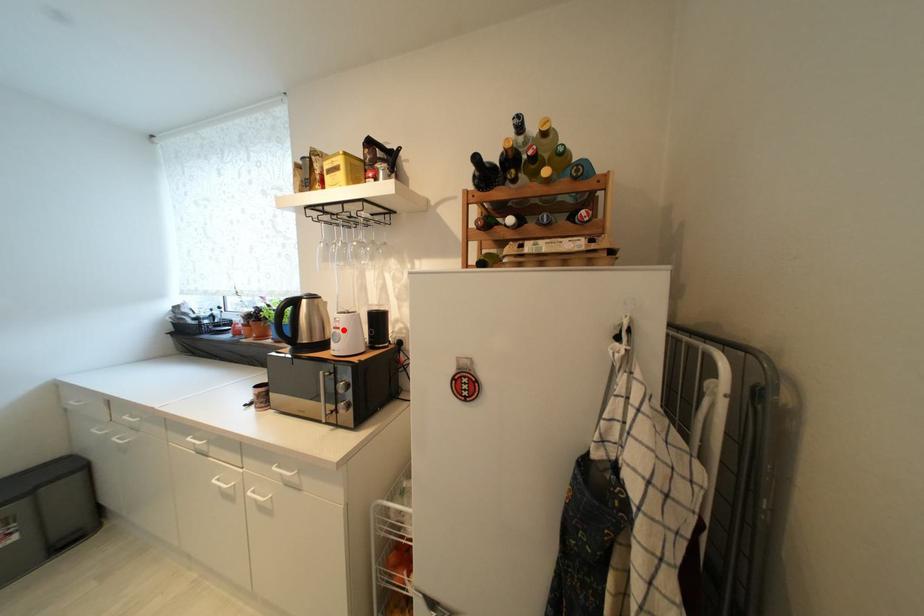
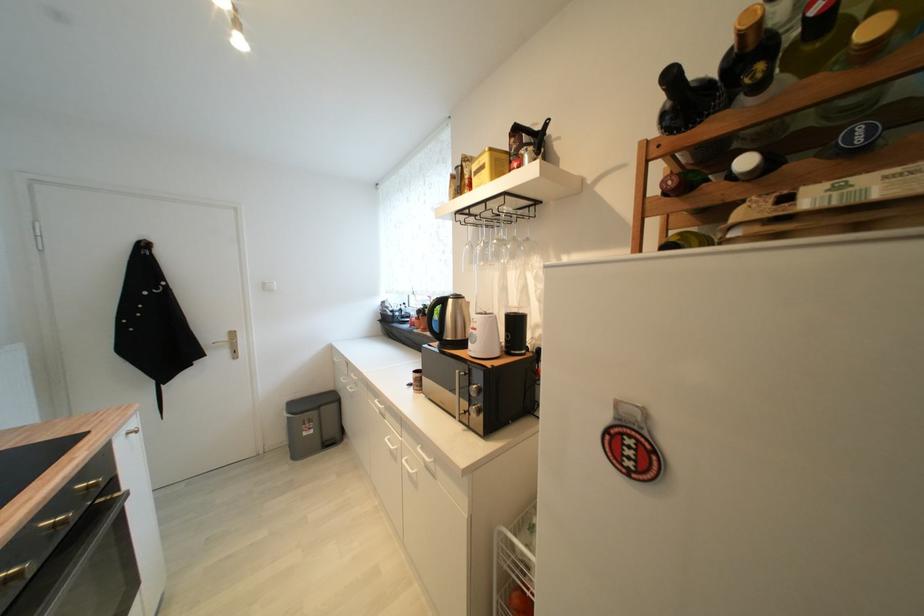
Find the pixel in the second image that matches the highlighted location in the first image.

(480, 331)